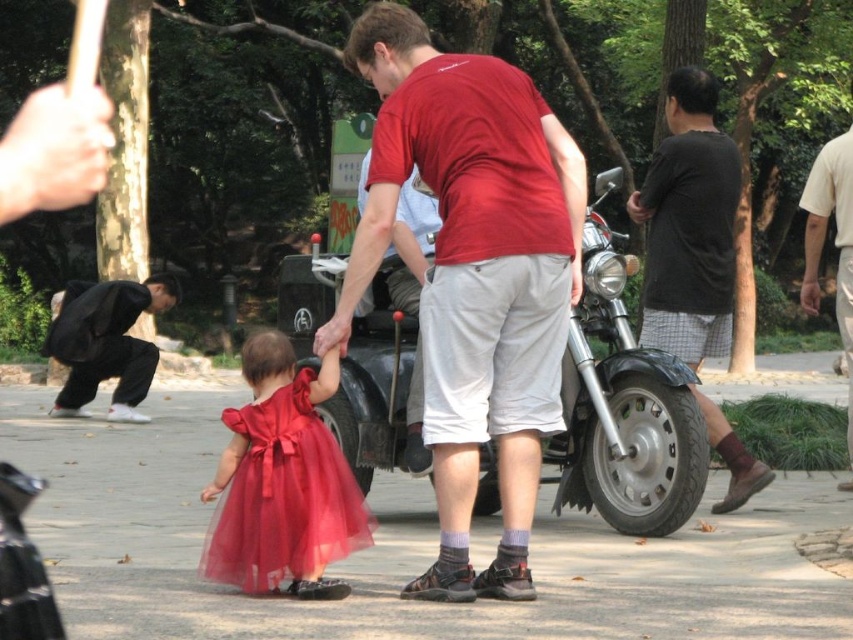
Question: Can you confirm if smooth concrete pavement at center is positioned above matte tulle dress at center?

Choices:
 (A) yes
 (B) no

Answer: (B)

Question: Which of the following is the closest to the observer?

Choices:
 (A) shiny metallic motorcycle at center
 (B) dark gray cotton shirt at right
 (C) smooth concrete pavement at center

Answer: (C)

Question: Which of the following is the farthest from the observer?

Choices:
 (A) pos(126,289)
 (B) pos(850,432)

Answer: (A)

Question: Is matte tulle dress at center further to camera compared to black cotton pants at left?

Choices:
 (A) yes
 (B) no

Answer: (B)

Question: Which point is farther to the camera?

Choices:
 (A) (657, 225)
 (B) (846, 156)
 (C) (424, 147)
 (D) (85, 323)

Answer: (D)

Question: From the image, what is the correct spatial relationship of shiny metallic motorcycle at center in relation to black cotton pants at left?

Choices:
 (A) above
 (B) below

Answer: (B)